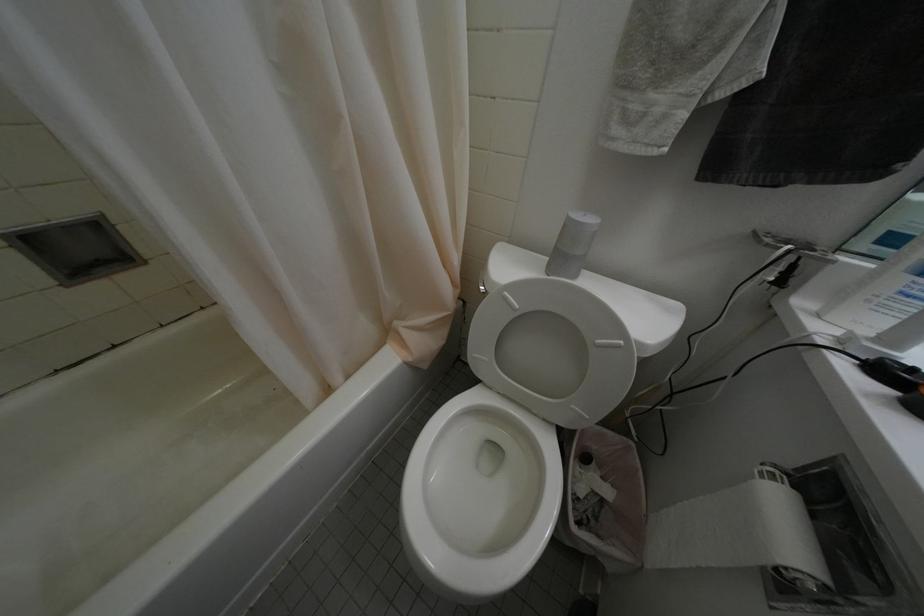
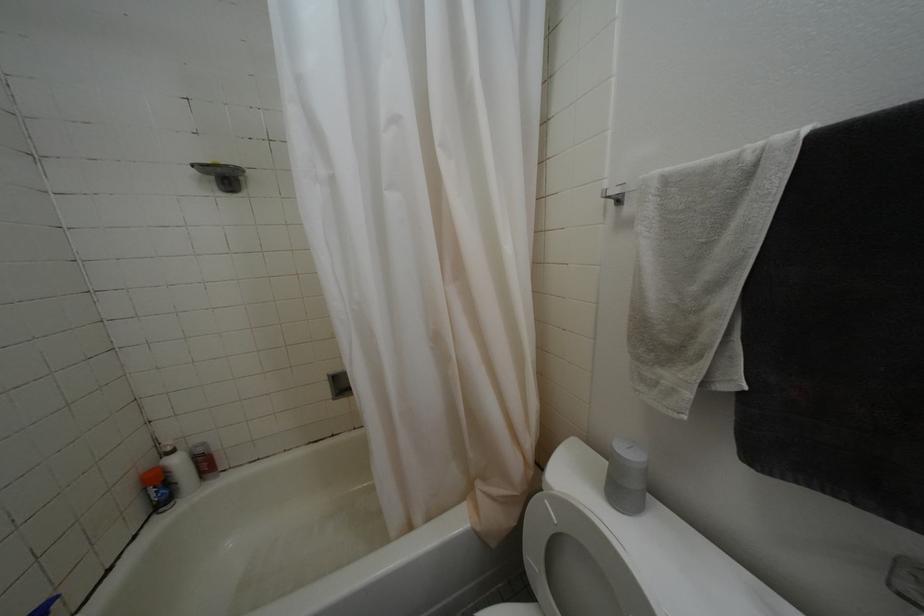
The first image is from the beginning of the video and the second image is from the end. How did the camera likely rotate when shooting the video?

The camera rotated toward left-up.